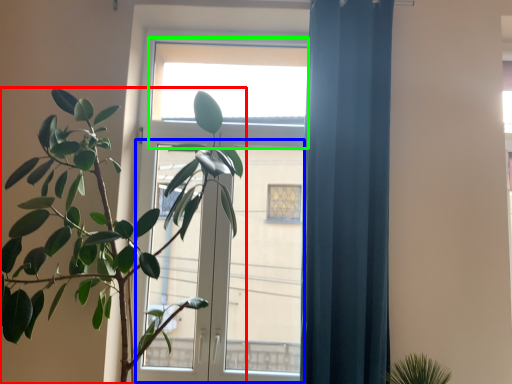
Question: Which object is the farthest from houseplant (highlighted by a red box)? Choose among these: screen door (highlighted by a blue box) or window (highlighted by a green box).

Choices:
 (A) screen door
 (B) window

Answer: (A)